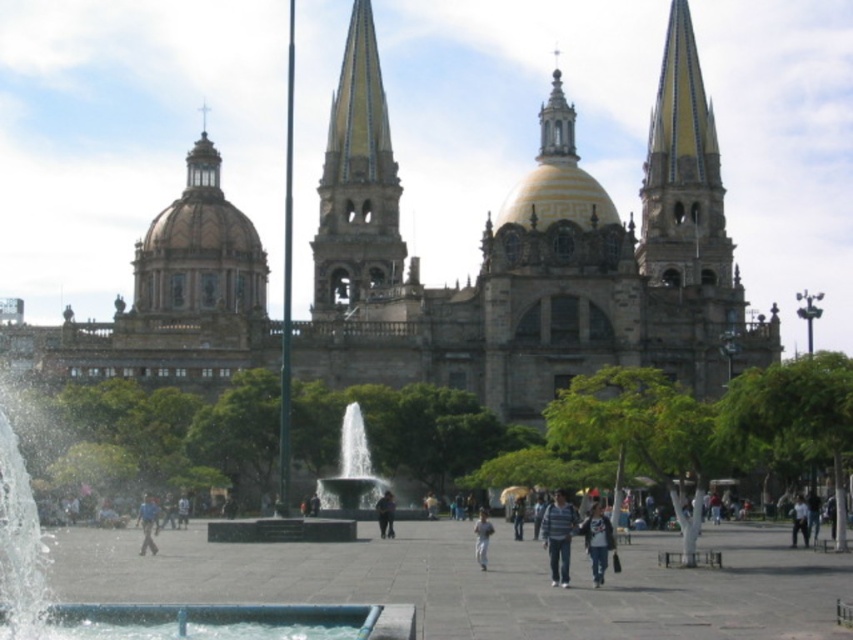
Question: Which object appears farthest from the camera in this image?

Choices:
 (A) light blue jeans at center
 (B) dark gray fabric jacket at center
 (C) gold mosaic steeple at center
 (D) white marble fountain at center

Answer: (C)

Question: Can you confirm if gold mosaic steeple at center is wider than dark gray fabric jacket at center?

Choices:
 (A) no
 (B) yes

Answer: (B)

Question: Estimate the real-world distances between objects in this image. Which object is farther from the smooth stone spire at upper right?

Choices:
 (A) dark blue jeans at center
 (B) blue fabric person at lower left
 (C) dark gray fabric jacket at center

Answer: (B)

Question: Is the position of blue denim jeans at center less distant than that of dark gray fabric jacket at center?

Choices:
 (A) yes
 (B) no

Answer: (A)

Question: In this image, where is blue denim jeans at center located relative to light blue jeans at center?

Choices:
 (A) below
 (B) above

Answer: (B)

Question: Which of the following is the farthest from the observer?

Choices:
 (A) brown stone church at center
 (B) smooth stone spire at upper right
 (C) white marble fountain at center

Answer: (B)